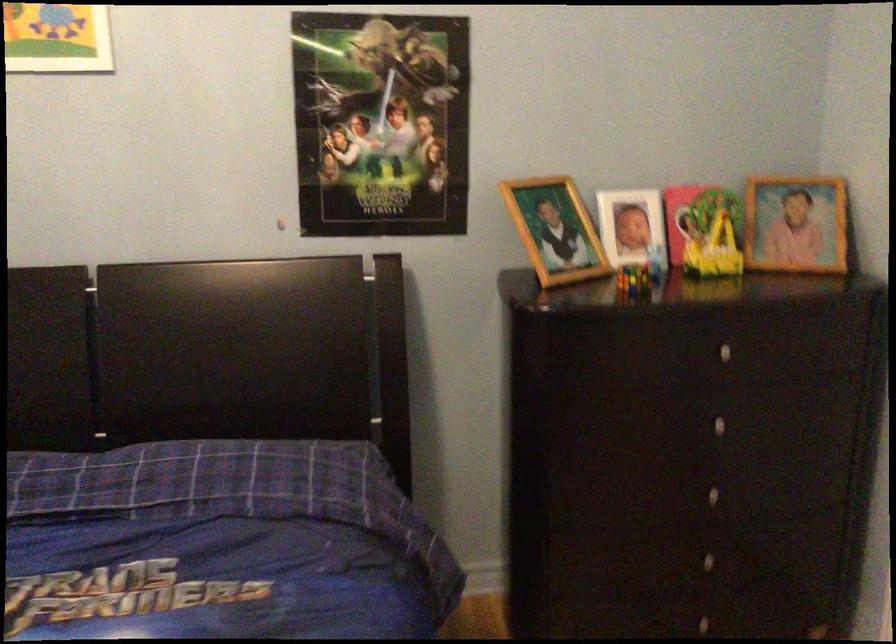
Where is `silver drawer knob`? Image resolution: width=896 pixels, height=644 pixels. silver drawer knob is located at coordinates (711, 516).